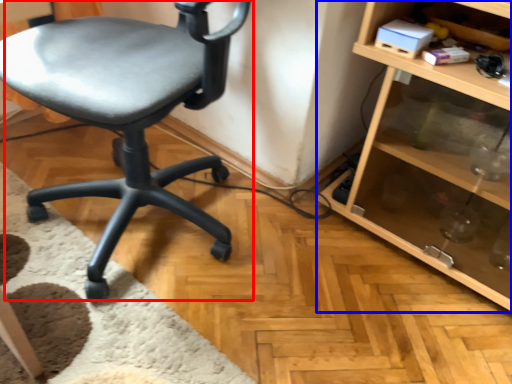
Question: Which object appears closest to the camera in this image, chair (highlighted by a red box) or shelf (highlighted by a blue box)?

Choices:
 (A) chair
 (B) shelf

Answer: (A)